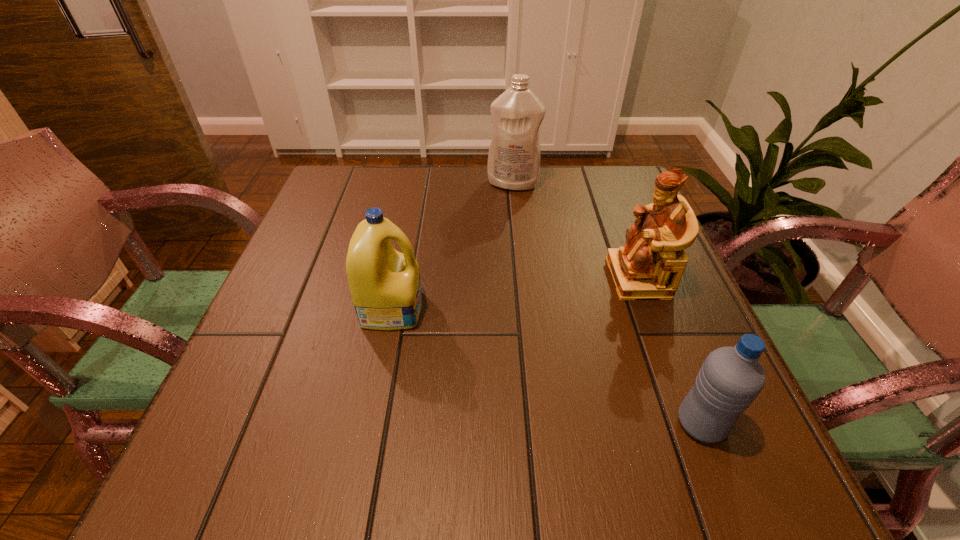
Identify the location of free space located 0.110m on the label of the nearer detergent. The image size is (960, 540). (477, 308).

Where is `free location located 0.390m on the left of the water bottle`? free location located 0.390m on the left of the water bottle is located at coordinates (429, 424).

Where is `object situated at the far edge`? Image resolution: width=960 pixels, height=540 pixels. object situated at the far edge is located at coordinates (514, 157).

The height and width of the screenshot is (540, 960). Find the location of `object at the near edge`. object at the near edge is located at coordinates (730, 379).

I want to click on figurine that is at the right edge, so click(650, 266).

Identify the location of water bottle present at the right edge. Image resolution: width=960 pixels, height=540 pixels. (730, 379).

Where is `object that is at the near right corner`? The height and width of the screenshot is (540, 960). object that is at the near right corner is located at coordinates (730, 379).

Find the location of a particular element. This screenshot has width=960, height=540. vacant region at the far edge of the desktop is located at coordinates (514, 193).

Where is `free space at the near edge`? The width and height of the screenshot is (960, 540). free space at the near edge is located at coordinates (566, 453).

Locate an element on the screen. Image resolution: width=960 pixels, height=540 pixels. blank space at the left edge of the desktop is located at coordinates (271, 293).